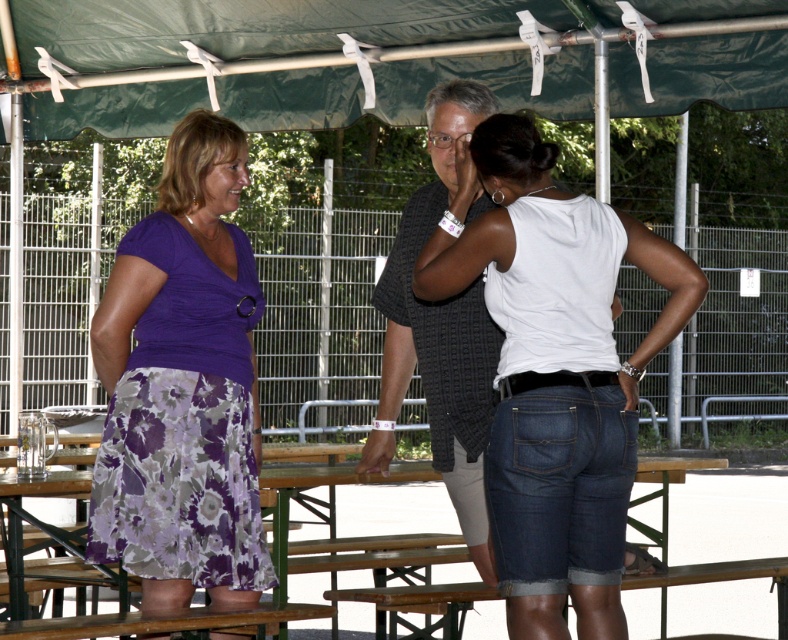
Can you confirm if green fabric canopy at upper center is shorter than white matte tank top at center?

Yes.

The height and width of the screenshot is (640, 788). I want to click on green fabric canopy at upper center, so click(374, 58).

You are a GUI agent. You are given a task and a screenshot of the screen. Output one action in this format:
    pyautogui.click(x=<x>, y=<y>)
    Task: Click on the green fabric canopy at upper center
    The width and height of the screenshot is (788, 640).
    Given the screenshot: What is the action you would take?
    pyautogui.click(x=374, y=58)

Is white matte tank top at center bigger than purple floral skirt at left?

Indeed, white matte tank top at center has a larger size compared to purple floral skirt at left.

Who is more distant from viewer, [504,115] or [121,540]?

Point [121,540]

Where is `white matte tank top at center`? white matte tank top at center is located at coordinates (556, 372).

Does purple floral skirt at left have a greater height compared to wooden picnic table at center?

Indeed, purple floral skirt at left has a greater height compared to wooden picnic table at center.

Describe the element at coordinates (184, 385) in the screenshot. The image size is (788, 640). I see `purple floral skirt at left` at that location.

Measure the distance between purple floral skirt at left and camera.

5.40 meters

Locate an element on the screen. purple floral skirt at left is located at coordinates (184, 385).